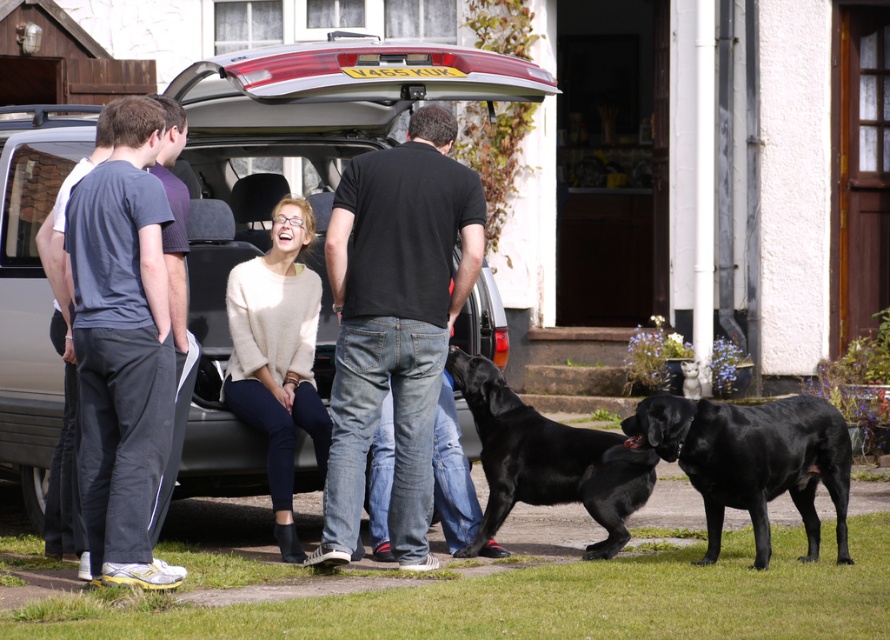
Where is `dark gray sweatpants at left`? The height and width of the screenshot is (640, 890). dark gray sweatpants at left is located at coordinates (122, 346).

Does dark gray sweatpants at left have a larger size compared to black glossy dog at lower right?

Indeed, dark gray sweatpants at left has a larger size compared to black glossy dog at lower right.

Who is more distant from viewer, (x=128, y=172) or (x=827, y=468)?

Positioned behind is point (x=827, y=468).

This screenshot has height=640, width=890. I want to click on dark gray sweatpants at left, so click(122, 346).

Who is more forward, [441,333] or [545,419]?

Point [441,333] is in front.

Locate an element on the screen. Image resolution: width=890 pixels, height=640 pixels. black cotton t-shirt at center is located at coordinates (395, 320).

Is point (282, 202) less distant than point (563, 442)?

No, (282, 202) is behind (563, 442).

Who is more distant from viewer, (286,547) or (569,497)?

Positioned behind is point (569,497).

Between point (280, 524) and point (496, 372), which one is positioned in front?

Positioned in front is point (280, 524).

Locate an element on the screen. light beige sweater at center is located at coordinates (278, 356).